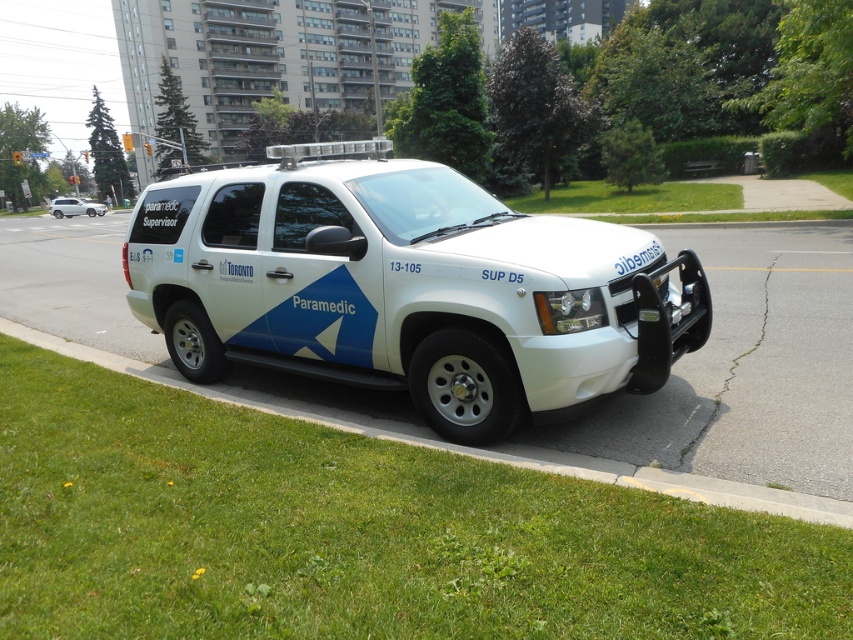
Question: Which object is closer to the camera taking this photo?

Choices:
 (A) white matte paramedic vehicle at center
 (B) white matte suv at center

Answer: (B)

Question: Is green grass at lower left smaller than white matte paramedic vehicle at center?

Choices:
 (A) yes
 (B) no

Answer: (A)

Question: Which point appears closest to the camera in this image?

Choices:
 (A) (74, 200)
 (B) (233, 268)
 (C) (155, 612)

Answer: (C)

Question: Does green grass at lower left appear under white matte paramedic vehicle at center?

Choices:
 (A) no
 (B) yes

Answer: (B)

Question: Based on their relative distances, which object is farther from the white matte suv at center?

Choices:
 (A) green grass at lower left
 (B) white matte paramedic vehicle at center

Answer: (B)

Question: Is white matte suv at center wider than white matte paramedic vehicle at center?

Choices:
 (A) yes
 (B) no

Answer: (B)